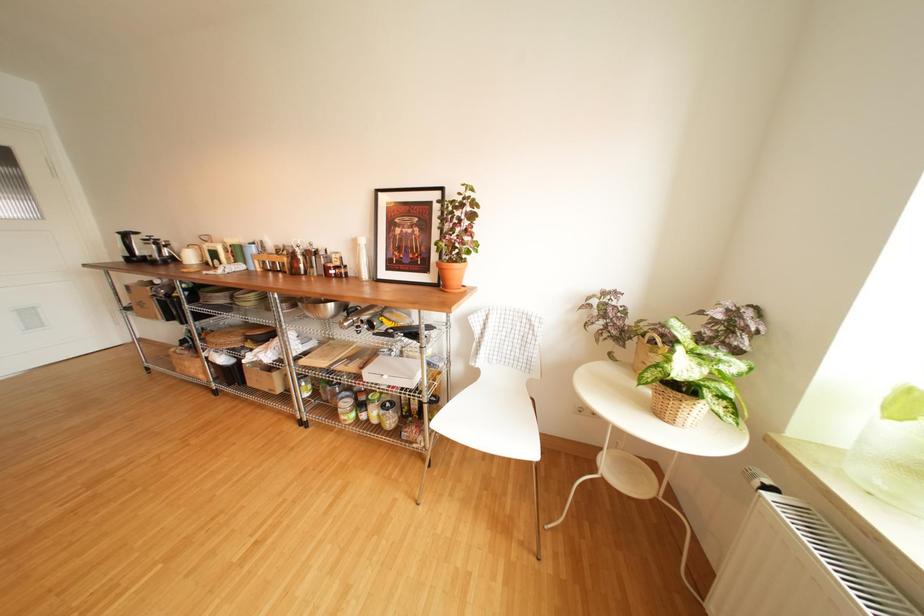
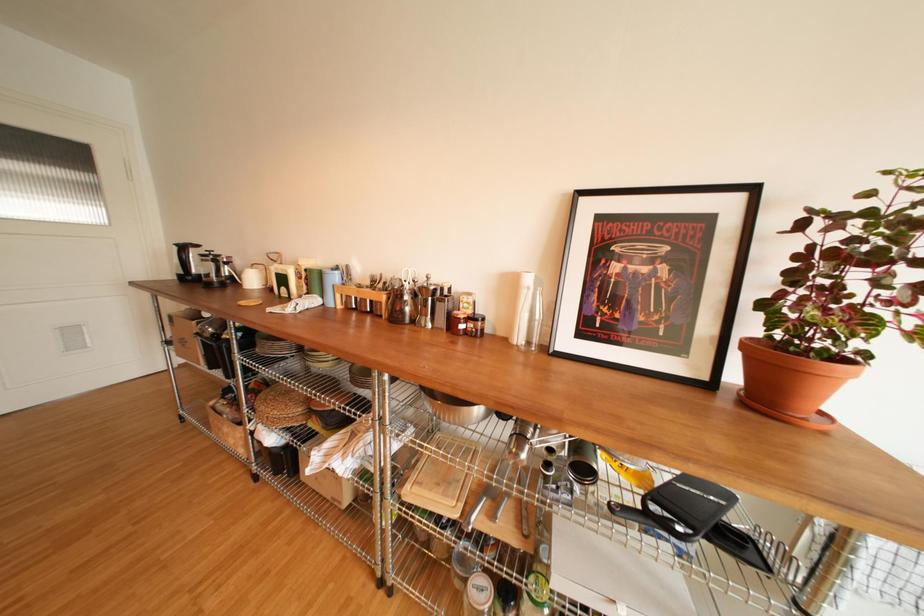
Question: The camera is either moving clockwise (left) or counter-clockwise (right) around the object. The first image is from the beginning of the video and the second image is from the end. Is the camera moving left or right when shooting the video?

Choices:
 (A) Left
 (B) Right

Answer: (B)